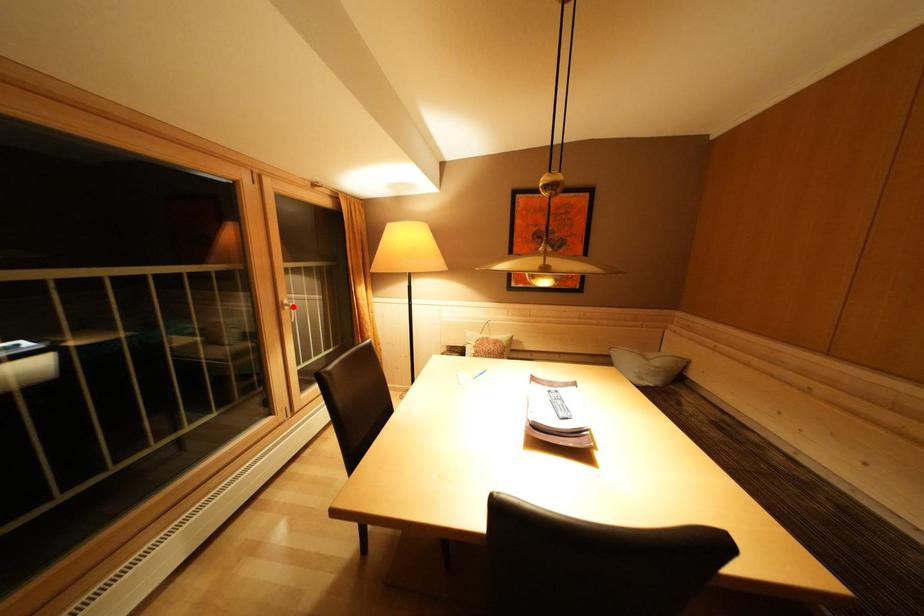
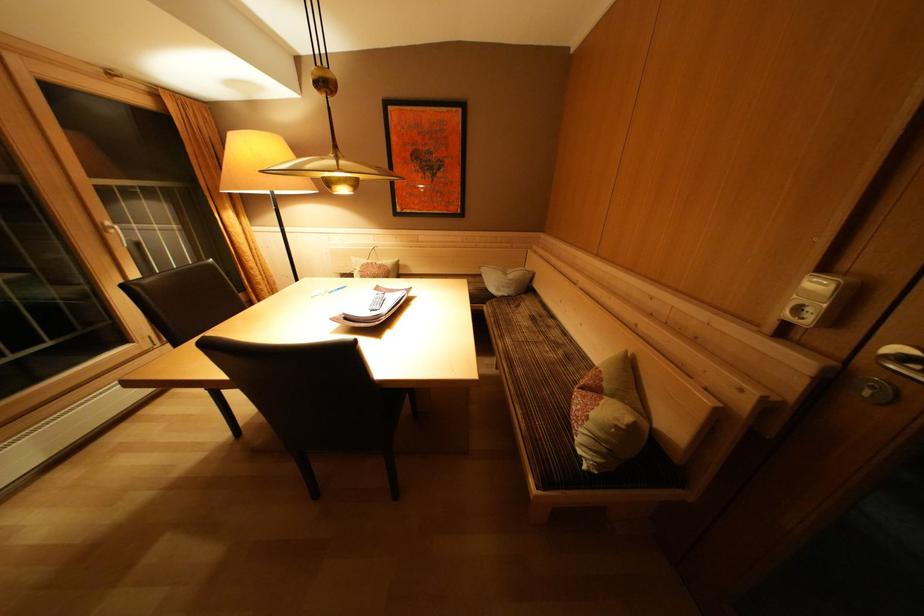
Question: I am providing you with two images of the same scene from different viewpoints. Image1 has a red point marked. In image2, the corresponding 3D location appears at what relative position? Reply with the corresponding letter.

Choices:
 (A) Closer
 (B) Farther

Answer: (B)